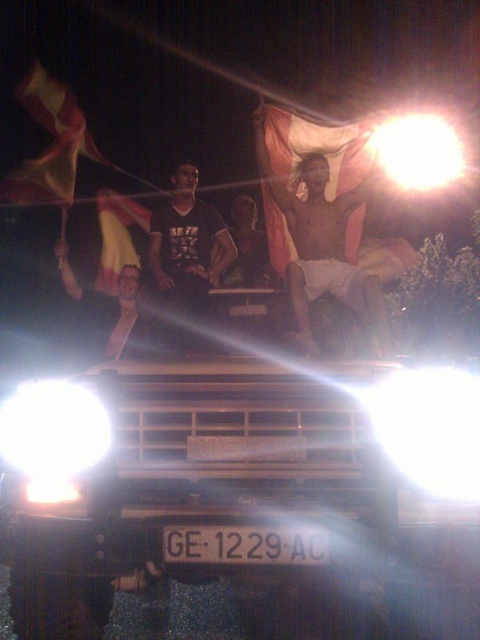
Question: Which object is the farthest from the white plastic license plate at center?

Choices:
 (A) black matte t-shirt at center
 (B) shiny metallic man at center
 (C) smooth plastic cup at center

Answer: (A)

Question: Can you confirm if black matte t-shirt at center is positioned to the left of smooth plastic cup at center?

Choices:
 (A) no
 (B) yes

Answer: (A)

Question: Which object appears farthest from the camera in this image?

Choices:
 (A) black matte t-shirt at center
 (B) shiny metallic man at center

Answer: (A)

Question: Does shiny metallic man at center lie in front of smooth plastic cup at center?

Choices:
 (A) yes
 (B) no

Answer: (A)

Question: Which is farther from the white plastic license plate at center?

Choices:
 (A) shiny metallic man at center
 (B) black matte t-shirt at center

Answer: (B)

Question: Is shiny metallic man at center closer to the viewer compared to black matte t-shirt at center?

Choices:
 (A) yes
 (B) no

Answer: (A)